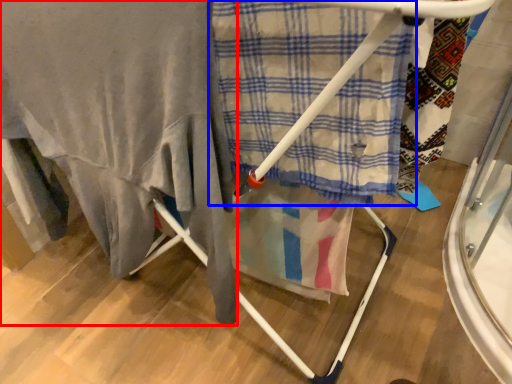
Question: Which object is further to the camera taking this photo, blanket (highlighted by a red box) or cloth (highlighted by a blue box)?

Choices:
 (A) blanket
 (B) cloth

Answer: (B)